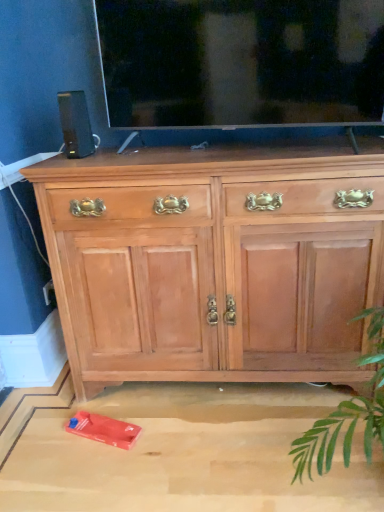
Find the location of a particular element. free space in front of light wood cabinet at center is located at coordinates (204, 450).